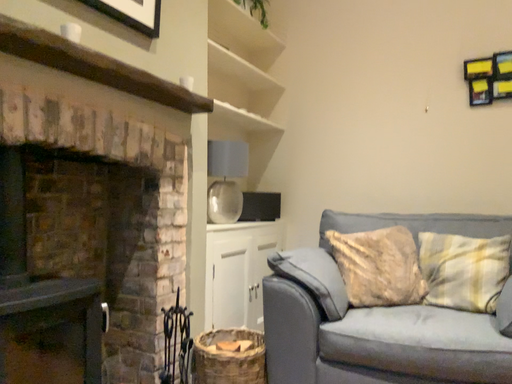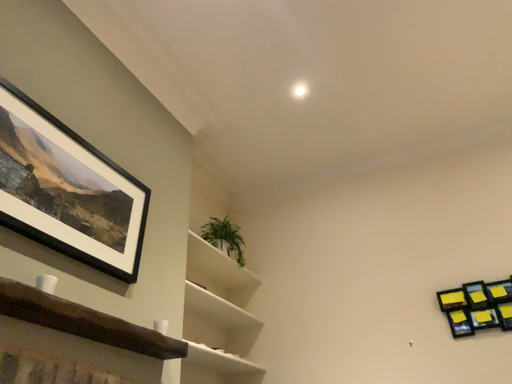
Question: Which way did the camera rotate in the video?

Choices:
 (A) rotated downward
 (B) rotated upward

Answer: (B)